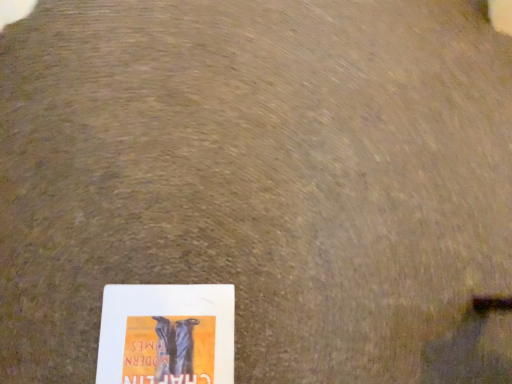
Image resolution: width=512 pixels, height=384 pixels. Identify the location of empty space that is ontop of orange paper poster at lower left (from a real-world perspective). (168, 343).